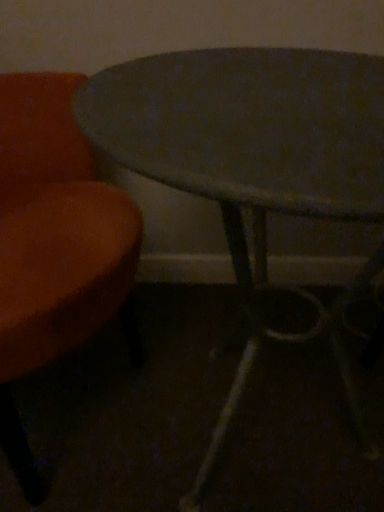
Question: From a real-world perspective, is metallic gray table at center positioned above or below velvet orange chair at left?

Choices:
 (A) below
 (B) above

Answer: (A)

Question: Considering their positions, is metallic gray table at center located in front of or behind velvet orange chair at left?

Choices:
 (A) front
 (B) behind

Answer: (B)

Question: From the image's perspective, is metallic gray table at center above or below velvet orange chair at left?

Choices:
 (A) above
 (B) below

Answer: (B)

Question: Is point (102, 233) closer or farther from the camera than point (226, 138)?

Choices:
 (A) farther
 (B) closer

Answer: (A)

Question: From a real-world perspective, is velvet orange chair at left above or below metallic gray table at center?

Choices:
 (A) above
 (B) below

Answer: (A)

Question: From their relative heights in the image, would you say velvet orange chair at left is taller or shorter than metallic gray table at center?

Choices:
 (A) tall
 (B) short

Answer: (A)

Question: Is velvet orange chair at left bigger or smaller than metallic gray table at center?

Choices:
 (A) big
 (B) small

Answer: (A)